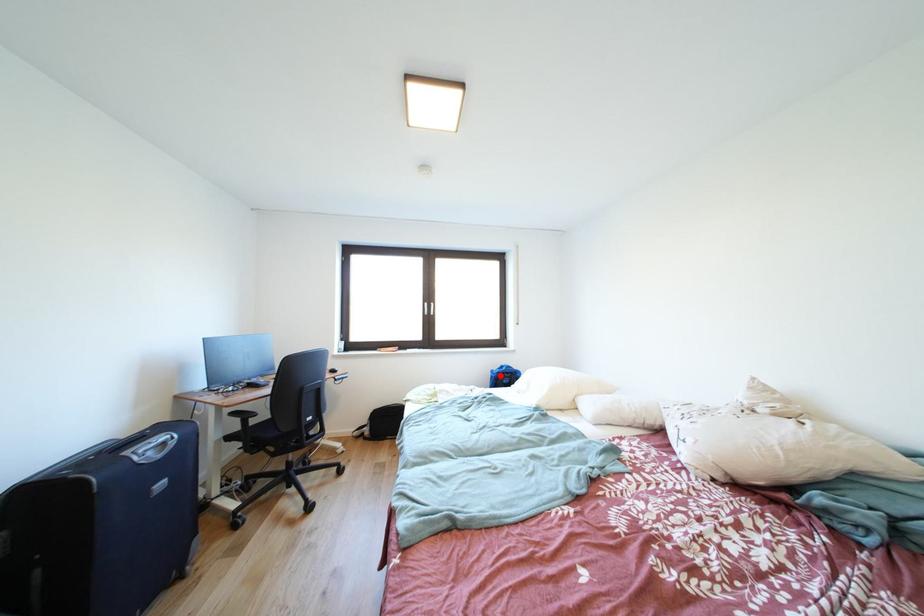
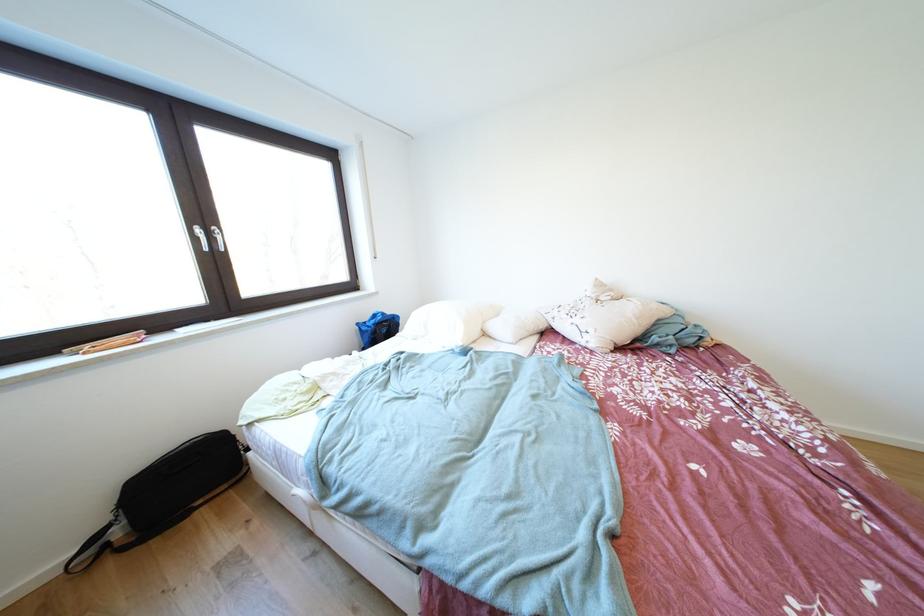
Question: A red point is marked in image1. In image2, is the corresponding 3D point closer to the camera or farther? Reply with the corresponding letter.

Choices:
 (A) The corresponding 3D point is closer.
 (B) The corresponding 3D point is farther.

Answer: (A)